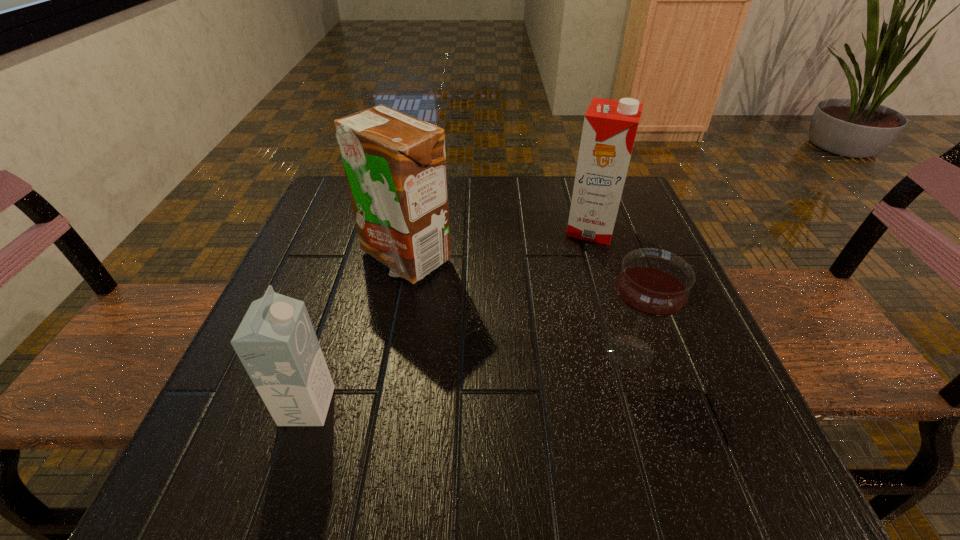
Find the location of a particular element. object situated at the far left corner is located at coordinates (395, 165).

This screenshot has width=960, height=540. Find the location of `object that is at the far right corner`. object that is at the far right corner is located at coordinates (610, 126).

The width and height of the screenshot is (960, 540). Identify the location of free space at the far edge of the desktop. (496, 222).

This screenshot has height=540, width=960. What are the coordinates of `free space at the near edge of the desktop` in the screenshot? It's located at (534, 459).

You are a GUI agent. You are given a task and a screenshot of the screen. Output one action in this format:
    pyautogui.click(x=<x>, y=<y>)
    Task: Click on the vacant space at the left edge of the desktop
    
    Given the screenshot: What is the action you would take?
    pyautogui.click(x=307, y=233)

In the image, there is a desktop. Where is `vacant space at the right edge`? vacant space at the right edge is located at coordinates (680, 338).

In the image, there is a desktop. Where is `vacant space at the far left corner`? The height and width of the screenshot is (540, 960). vacant space at the far left corner is located at coordinates (350, 206).

Where is `free space at the far right corner`? Image resolution: width=960 pixels, height=540 pixels. free space at the far right corner is located at coordinates (628, 218).

Where is `vacant area that lies between the rightmost carton and the third tallest object`? This screenshot has width=960, height=540. vacant area that lies between the rightmost carton and the third tallest object is located at coordinates (449, 317).

I want to click on free space that is in between the third farthest object and the nearest carton, so click(468, 379).